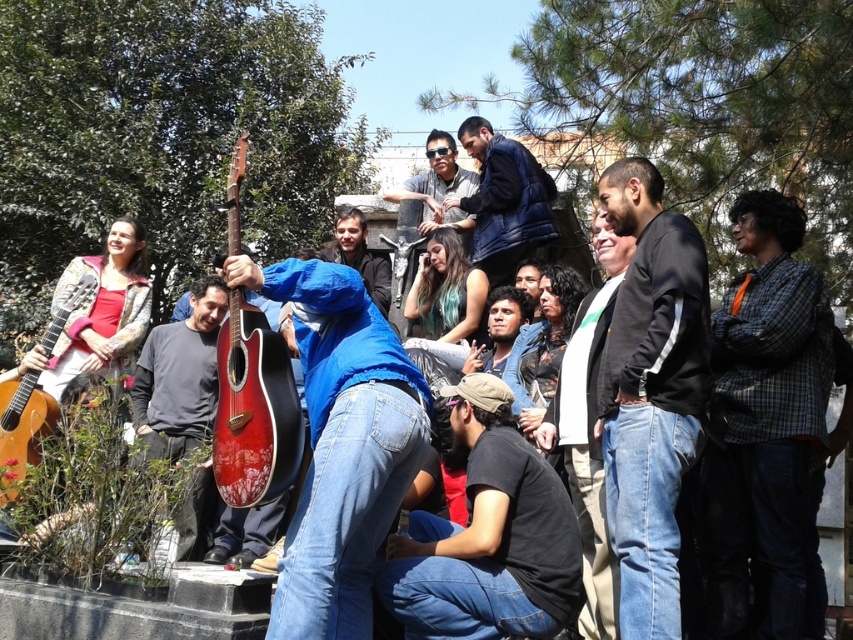
Question: Which point is farther to the camera?

Choices:
 (A) (566, 380)
 (B) (534, 198)
 (C) (439, 163)

Answer: (C)

Question: Considering the real-world distances, which object is closest to the glossy wood guitar at center?

Choices:
 (A) matte blue hoodie at center
 (B) dark blue puffy jacket at center

Answer: (A)

Question: Is matte blue hoodie at center further to camera compared to blue denim jacket at center?

Choices:
 (A) yes
 (B) no

Answer: (B)

Question: Estimate the real-world distances between objects in this image. Which object is farther from the acoustic wood guitar at left?

Choices:
 (A) plaid shirt at right
 (B) blue denim jacket at center
 (C) matte red guitar at center

Answer: (A)

Question: Can you confirm if plaid shirt at right is positioned to the right of blue denim jeans at center?

Choices:
 (A) yes
 (B) no

Answer: (A)

Question: Can you confirm if glossy wood guitar at center is thinner than blue denim jeans at center?

Choices:
 (A) no
 (B) yes

Answer: (A)